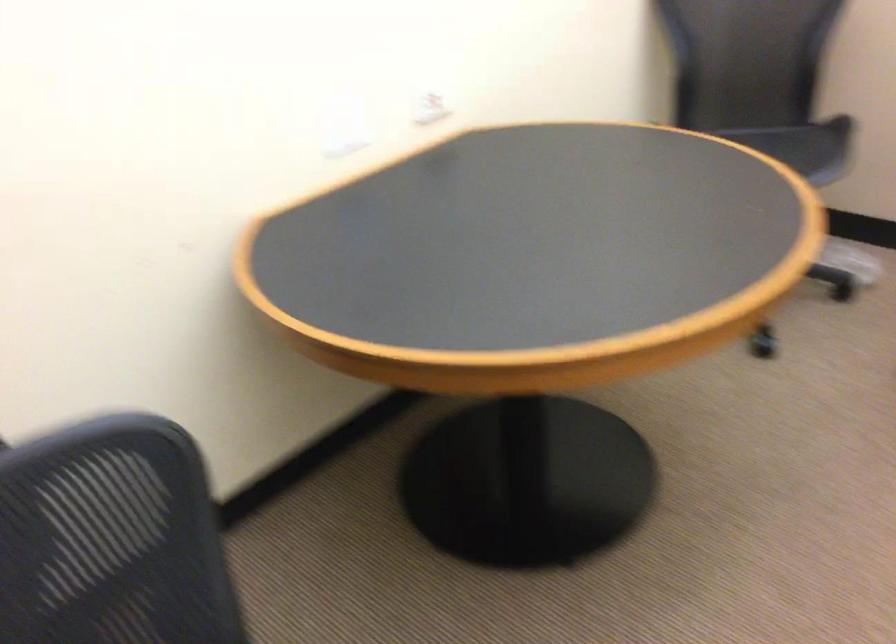
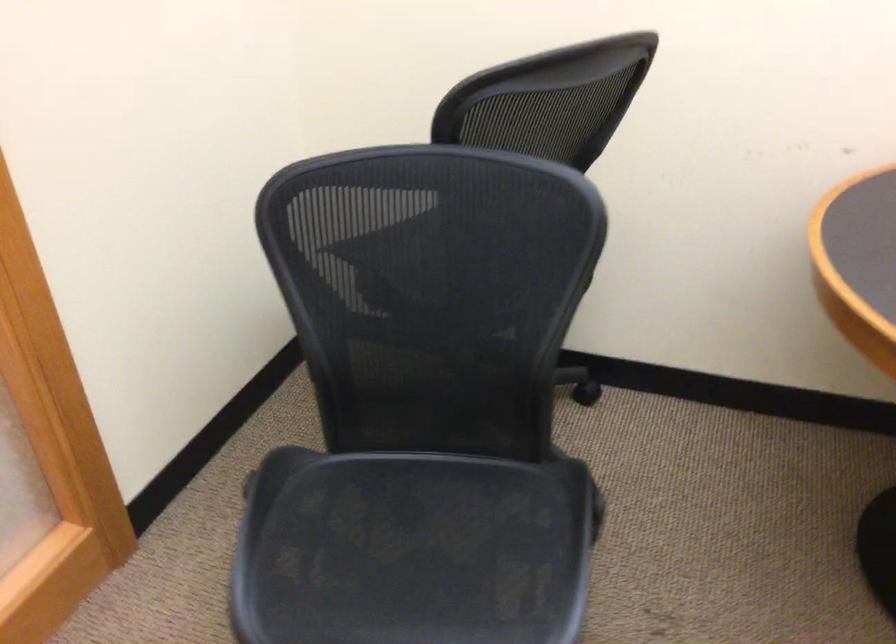
Based on the continuous images, in which direction is the camera rotating?

The camera's rotation is toward left-down.